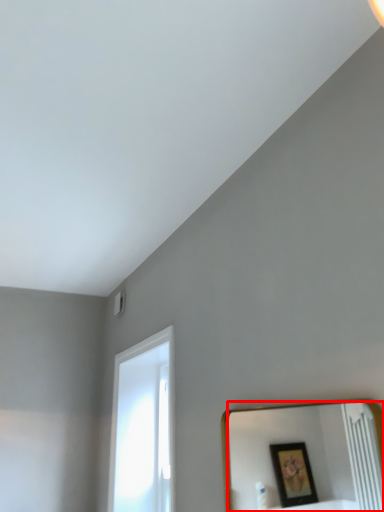
Question: In this image, where is mirror (annotated by the red box) located relative to window?

Choices:
 (A) right
 (B) left

Answer: (A)